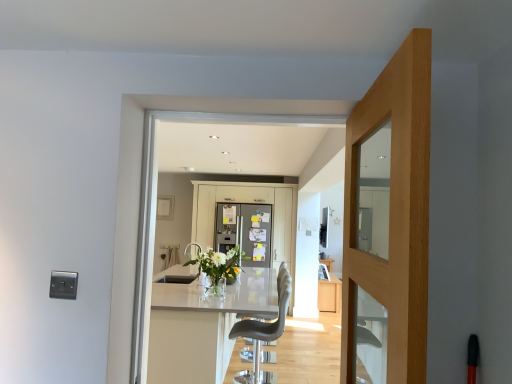
Question: Is clear glass vase at center taller or shorter than matte white cabinet at center?

Choices:
 (A) tall
 (B) short

Answer: (B)

Question: Is clear glass vase at center spatially inside matte white cabinet at center, or outside of it?

Choices:
 (A) inside
 (B) outside

Answer: (B)

Question: Estimate the real-world distances between objects in this image. Which object is closer to the matte gray bar stool at center?

Choices:
 (A) satin silver refrigerator at center
 (B) white glossy table at center
 (C) satin white refrigerator at center
 (D) matte white cabinet at center
 (E) light oak door at center

Answer: (B)

Question: Based on their relative distances, which object is nearer to the satin white refrigerator at center?

Choices:
 (A) matte gray bar stool at center
 (B) clear glass vase at center
 (C) light oak door at center
 (D) matte white cabinet at center
 (E) satin silver refrigerator at center

Answer: (E)